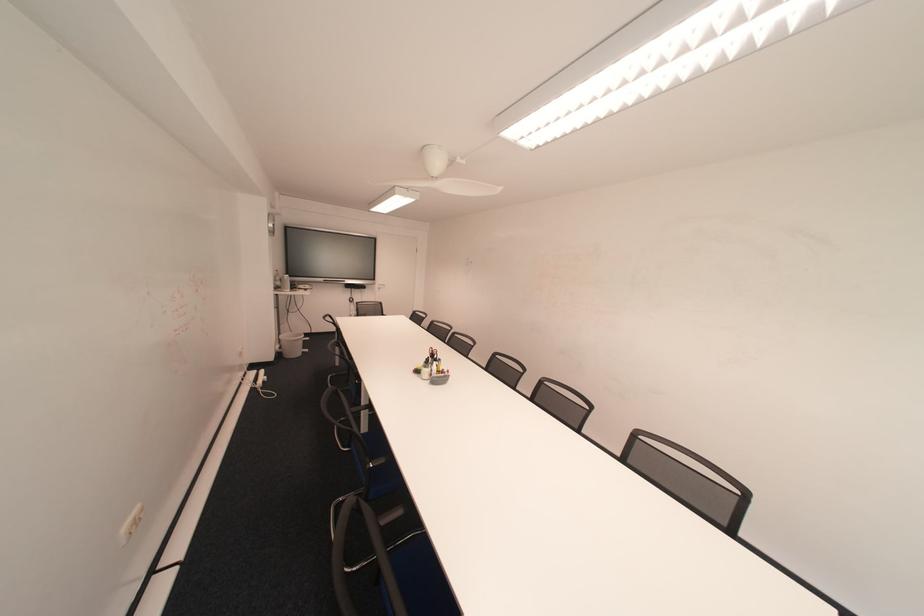
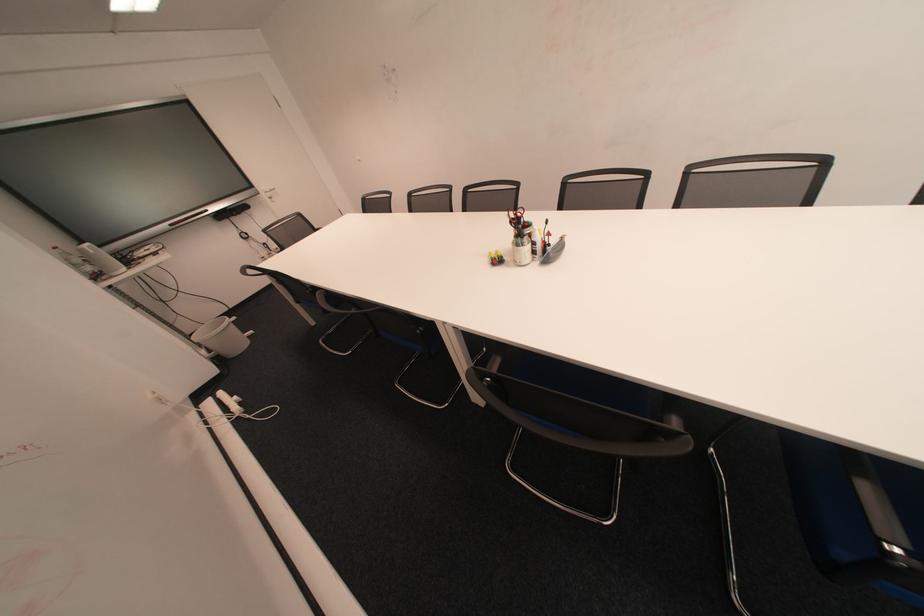
Find the pixel in the second image that matches [440,382] in the first image.

(550, 262)